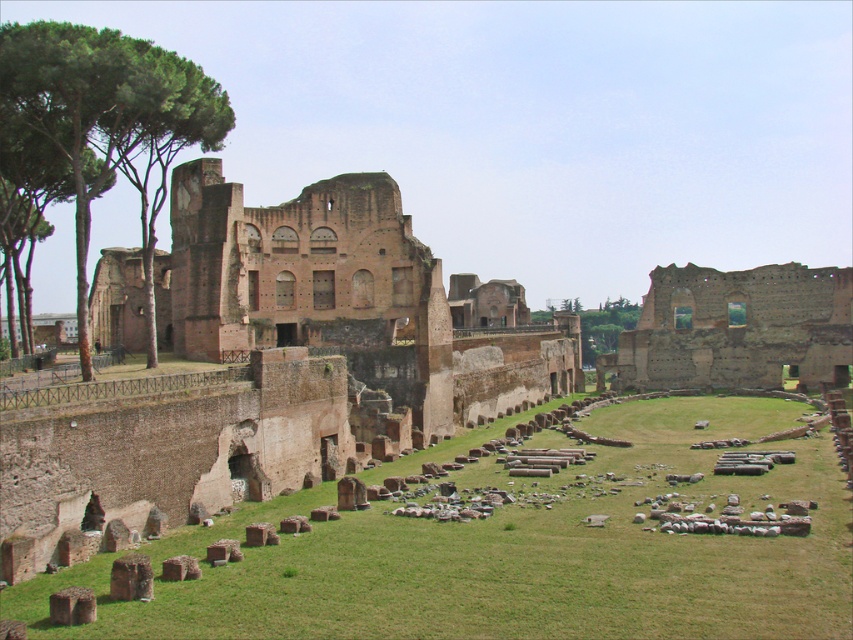
Question: Which point appears closest to the camera in this image?

Choices:
 (A) (610, 496)
 (B) (621, 321)
 (C) (90, 29)

Answer: (C)

Question: Is green grass at center below green leafy tree at center?

Choices:
 (A) yes
 (B) no

Answer: (A)

Question: Can you confirm if brown stone ruins at center right is positioned to the right of green leafy tree at center?

Choices:
 (A) yes
 (B) no

Answer: (A)

Question: Which object is farther from the camera taking this photo?

Choices:
 (A) brown stone ruins at center right
 (B) green leafy tree at center
 (C) green grass at center

Answer: (B)

Question: Which object appears closest to the camera in this image?

Choices:
 (A) brown stone ruins at center right
 (B) green leafy tree at center
 (C) green grass at center
 (D) green leafy tree at upper left

Answer: (C)

Question: Is green leafy tree at upper left thinner than green leafy tree at center?

Choices:
 (A) no
 (B) yes

Answer: (A)